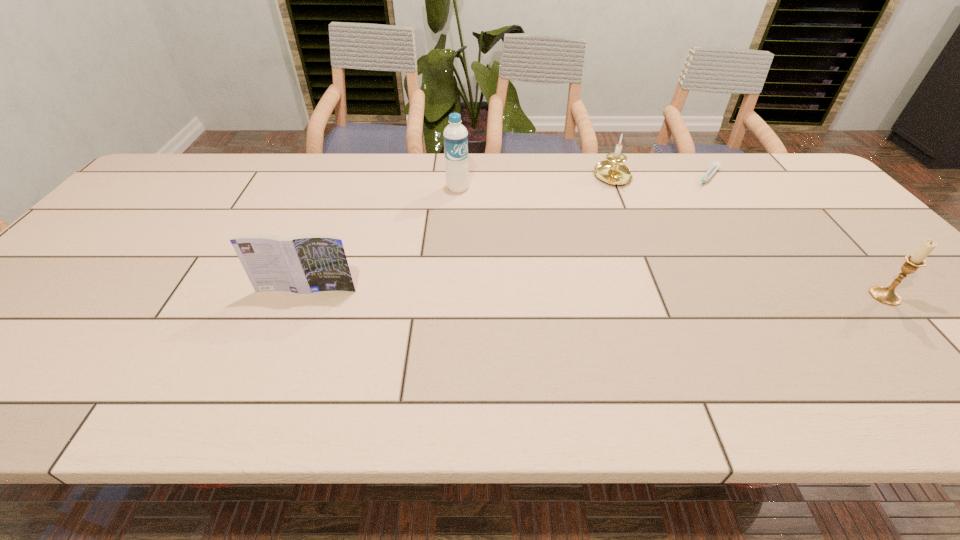
At what (x,y) coordinates should I click in order to perform the action: click on free space located on the back of the rightmost object. Please return your answer as a coordinate pair (x, y). This screenshot has width=960, height=540. Looking at the image, I should click on (806, 210).

Where is `free spot located 0.370m on the label of the tallest object`? free spot located 0.370m on the label of the tallest object is located at coordinates (530, 267).

This screenshot has height=540, width=960. I want to click on vacant space located 0.190m on the label of the tallest object, so click(494, 228).

This screenshot has height=540, width=960. Identify the location of free space located on the label of the tallest object. (521, 258).

Locate an element on the screen. blank area located at the needle end of the syringe is located at coordinates (692, 200).

The image size is (960, 540). Find the location of `vacant area located 0.050m at the needle end of the syringe`. vacant area located 0.050m at the needle end of the syringe is located at coordinates (696, 195).

This screenshot has width=960, height=540. Identify the location of vacant space located 0.270m at the needle end of the syringe. (666, 231).

This screenshot has height=540, width=960. In order to click on vacant area located 0.190m on the handle side of the farther candle holder in this screenshot , I will do `click(640, 231)`.

Where is `free location located 0.310m on the handle side of the farther candle holder`? The image size is (960, 540). free location located 0.310m on the handle side of the farther candle holder is located at coordinates (656, 260).

Locate an element on the screen. The height and width of the screenshot is (540, 960). vacant space located 0.130m on the handle side of the farther candle holder is located at coordinates (634, 218).